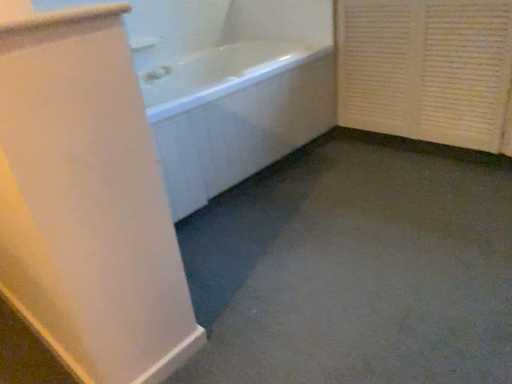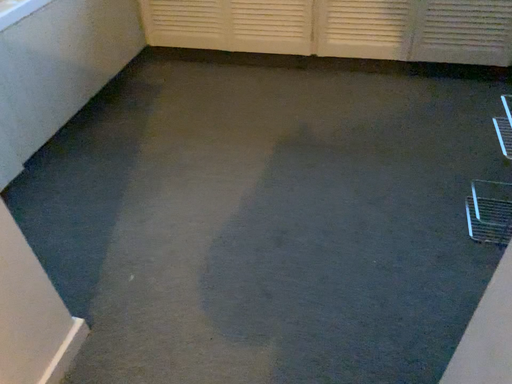
Question: Which way did the camera rotate in the video?

Choices:
 (A) rotated right
 (B) rotated left

Answer: (A)